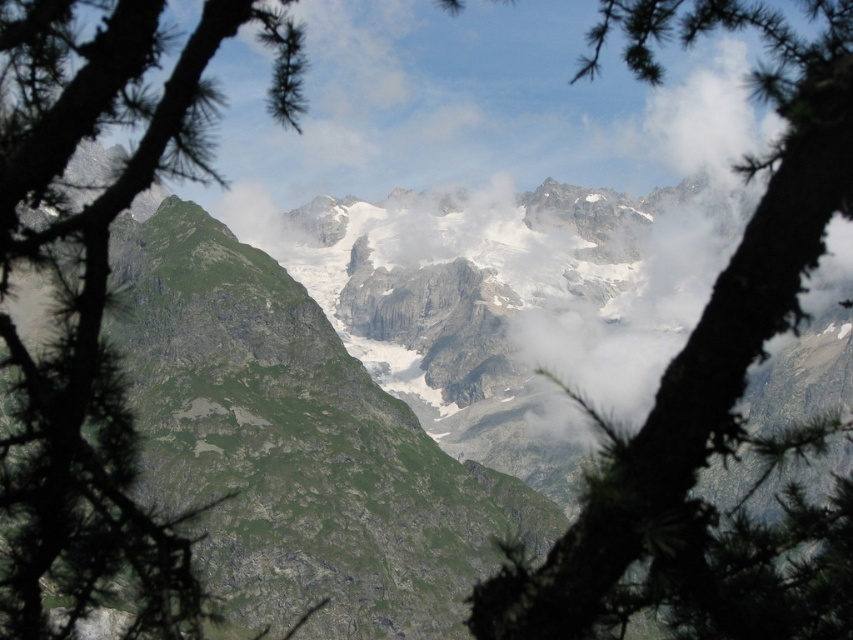
You are standing in front of the mountain landscape scene. There is a point marked at coordinates point (712, 390). What object is located at this point?

The point (712, 390) corresponds to the green textured branch at center.